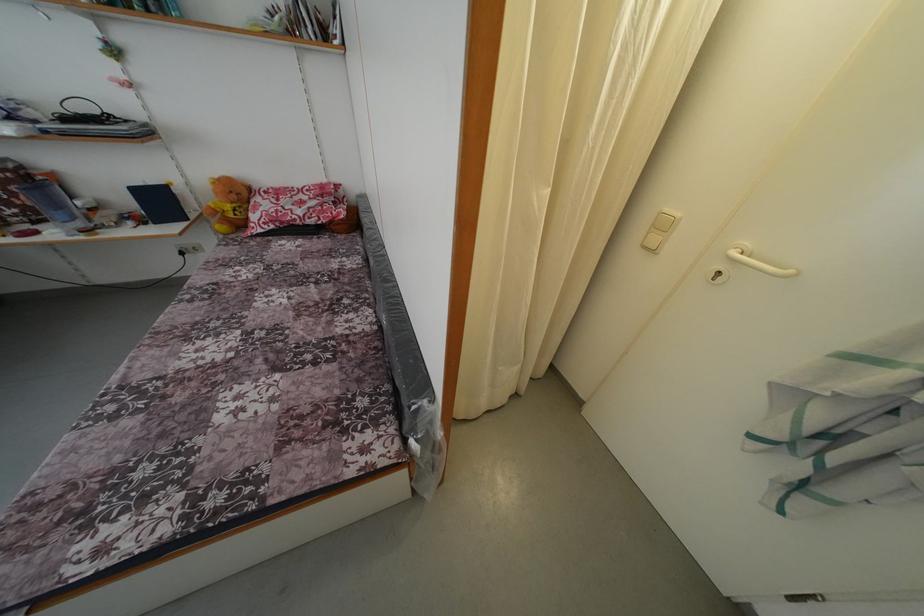
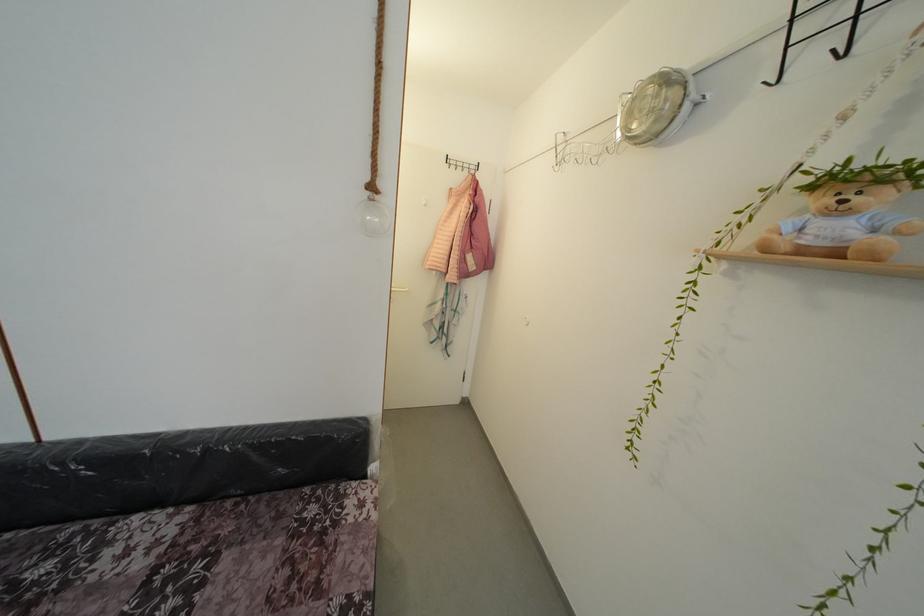
Question: The images are taken continuously from a first-person perspective. In which direction is your viewpoint rotating?

Choices:
 (A) Left
 (B) Right
 (C) Up
 (D) Down

Answer: (B)